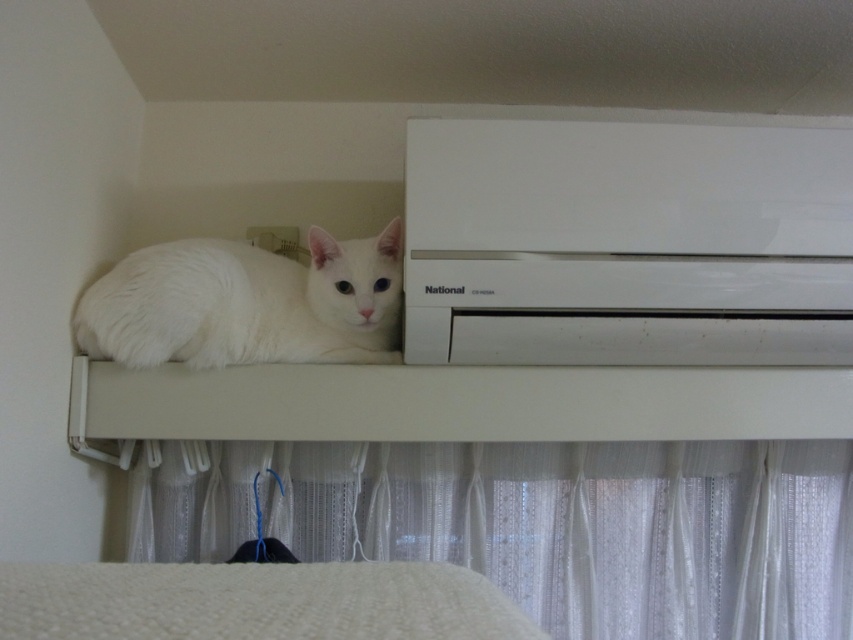
Question: Can you confirm if sheer white curtain at lower center is positioned to the left of white fluffy cat at upper center?

Choices:
 (A) yes
 (B) no

Answer: (B)

Question: Does sheer white curtain at lower center appear on the left side of white fluffy cat at upper center?

Choices:
 (A) yes
 (B) no

Answer: (B)

Question: Is sheer white curtain at lower center to the left of white fluffy cat at upper center from the viewer's perspective?

Choices:
 (A) yes
 (B) no

Answer: (B)

Question: Which of the following is the farthest from the observer?

Choices:
 (A) (744, 627)
 (B) (167, 317)

Answer: (A)